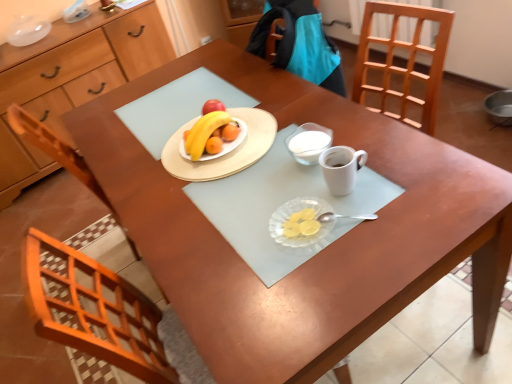
Identify the location of vacant position to the left of transparent glass plate at center. The image size is (512, 384). (231, 248).